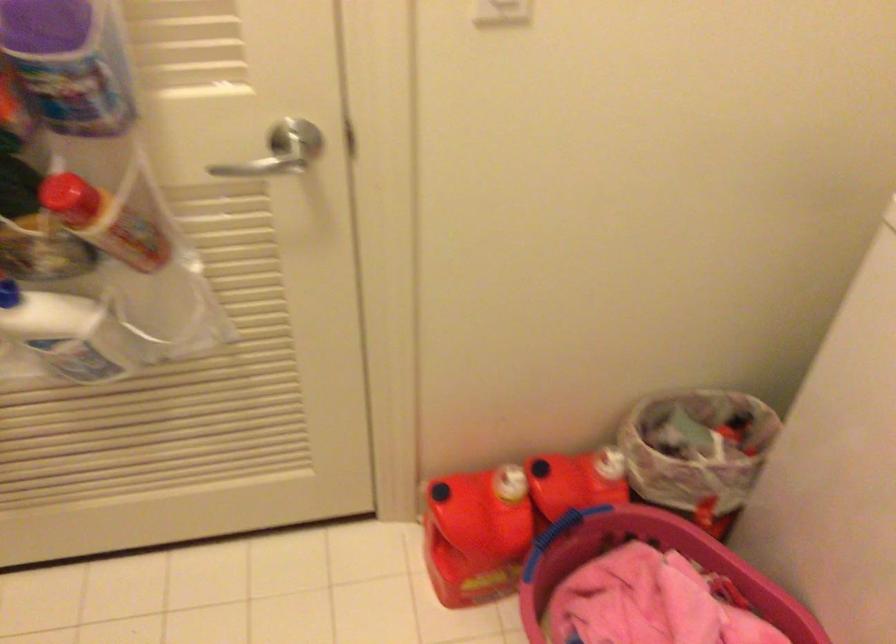
Which object does [476,534] point to?

It refers to a red-capped bottle.